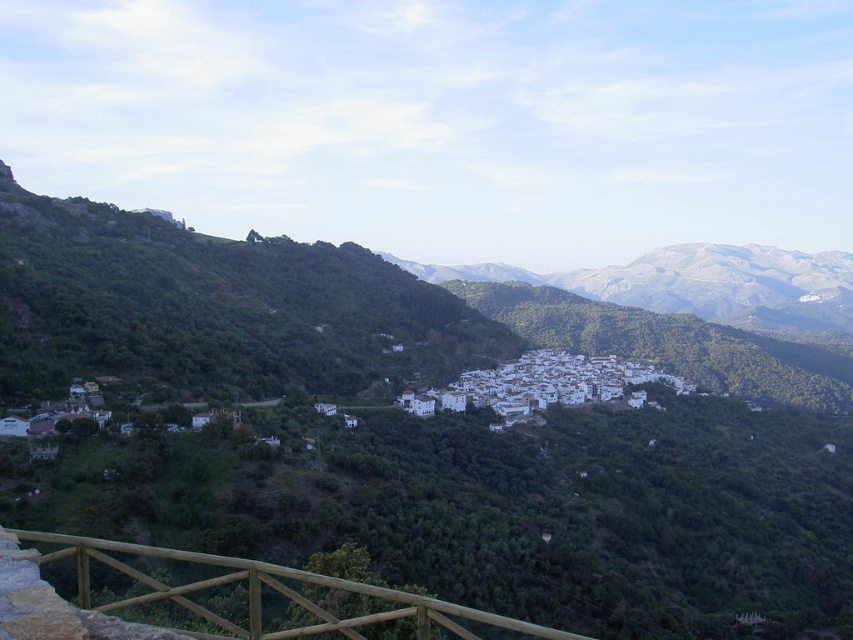
You are standing at the edge of the valley and want to walk towards the white matte village at center. Which direction should you move relative to the brown wooden rail at lower left?

You should move to the right of the brown wooden rail at lower left to head towards the white matte village at center since the village is to the right of the rail.

You are standing at the point labeled as point [396,436] in the image. What can you see directly in front of you?

The point [396,436] indicates green leafy hillside at center, so you would see the green leafy hillside at center directly in front of you.